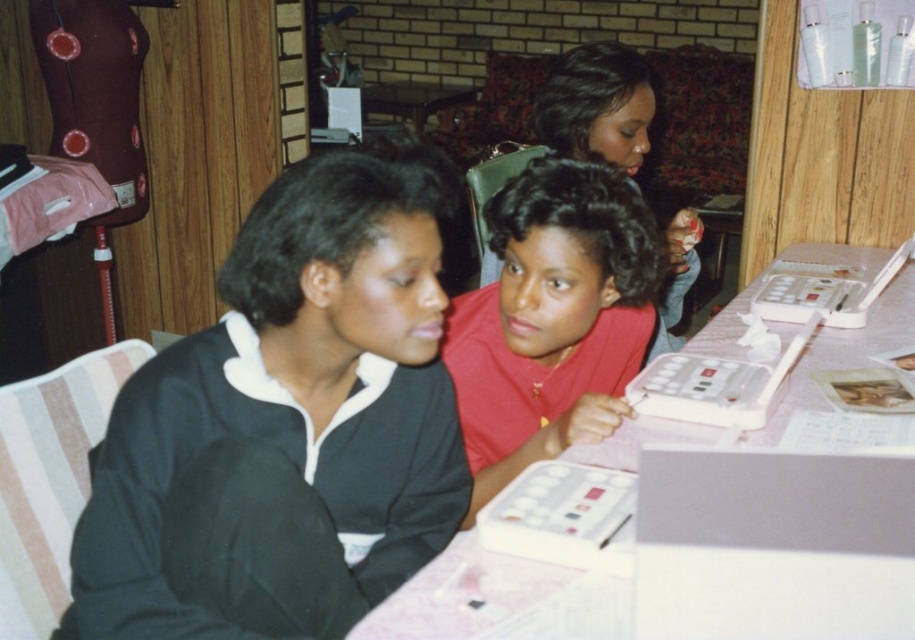
Is black matte jacket at left smaller than matte pink shirt at center?

Correct, black matte jacket at left occupies less space than matte pink shirt at center.

Can you confirm if black matte jacket at left is shorter than matte pink shirt at center?

Yes.

Describe the element at coordinates (289, 413) in the screenshot. I see `black matte jacket at left` at that location.

The width and height of the screenshot is (915, 640). I want to click on black matte jacket at left, so click(289, 413).

Can you confirm if black matte jacket at left is thinner than pink plastic table at center?

Indeed, black matte jacket at left has a lesser width compared to pink plastic table at center.

Who is positioned more to the left, black matte jacket at left or pink plastic table at center?

black matte jacket at left

The width and height of the screenshot is (915, 640). Find the location of `black matte jacket at left`. black matte jacket at left is located at coordinates (289, 413).

The image size is (915, 640). I want to click on black matte jacket at left, so click(289, 413).

Which is above, matte red shirt at center or matte pink shirt at center?

matte pink shirt at center

Locate an element on the screen. This screenshot has height=640, width=915. matte red shirt at center is located at coordinates (552, 317).